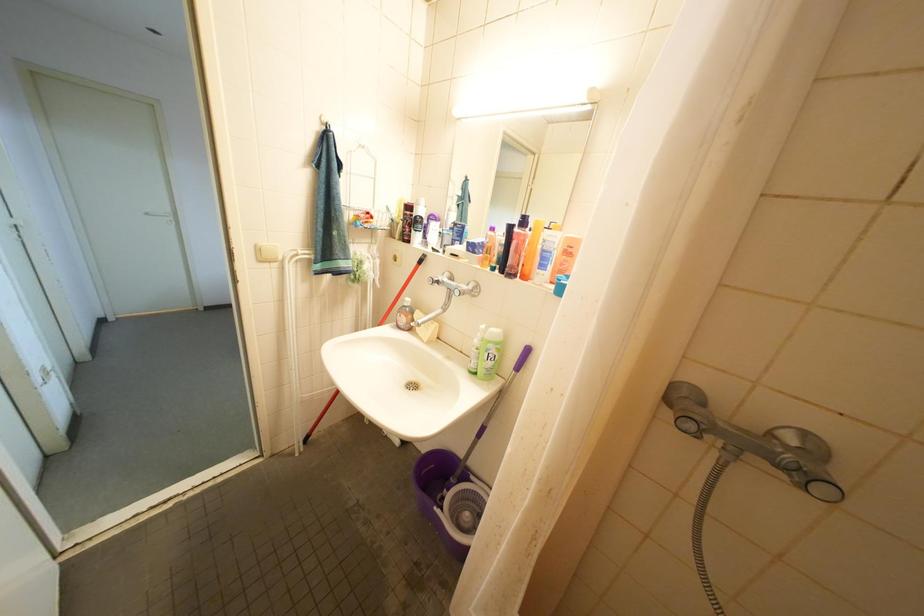
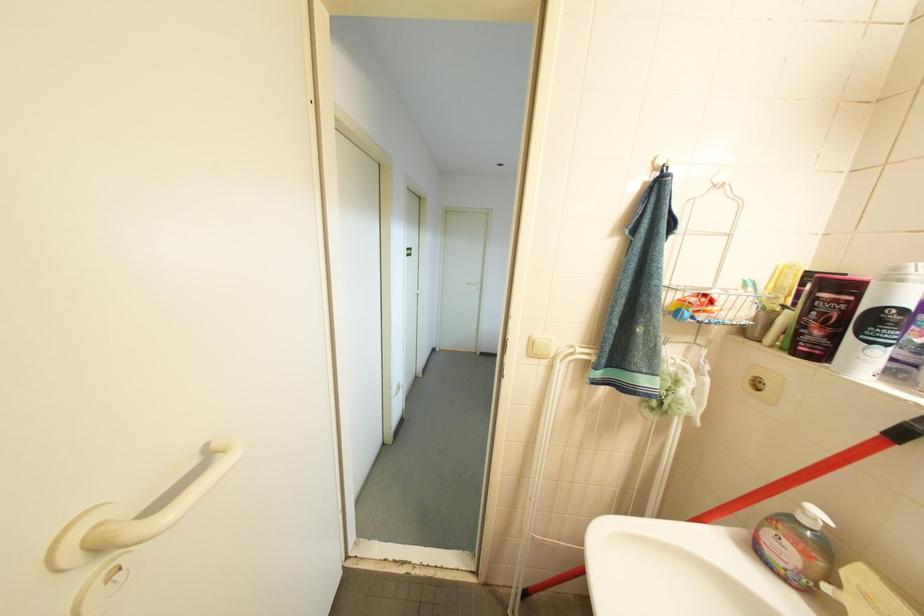
Question: The camera is either moving clockwise (left) or counter-clockwise (right) around the object. The first image is from the beginning of the video and the second image is from the end. Is the camera moving left or right when shooting the video?

Choices:
 (A) Left
 (B) Right

Answer: (B)